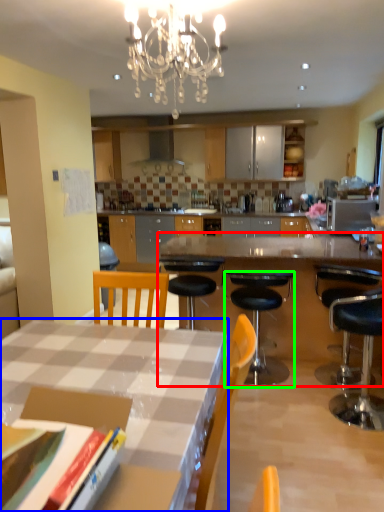
Question: Based on their relative distances, which object is farther from table (highlighted by a red box)? Choose from desk (highlighted by a blue box) and chair (highlighted by a green box).

Choices:
 (A) desk
 (B) chair

Answer: (A)